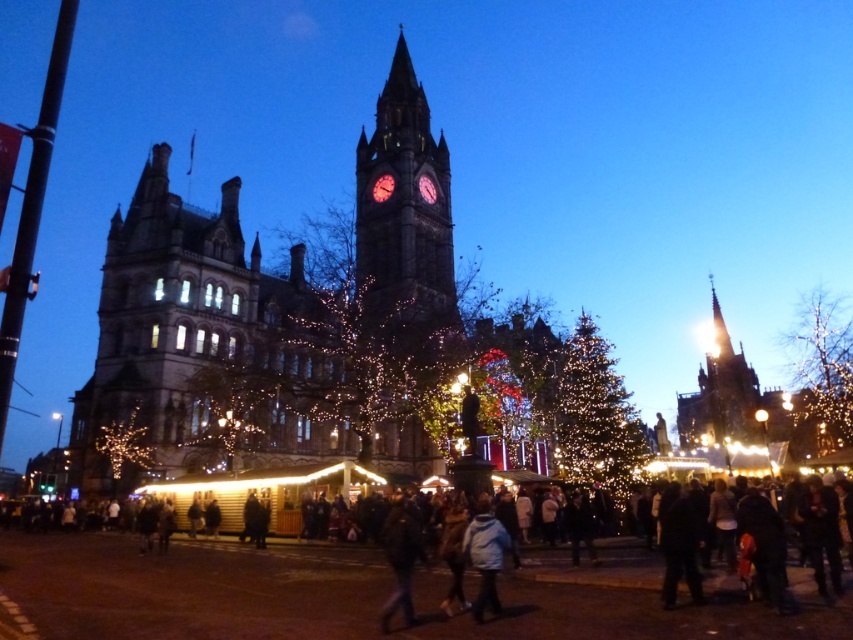
You are standing in the festive market area in front of the historic building. You want to take a photo of the polished stone clock tower at center. If your camera can focus on objects up to 250 feet away, will you be able to capture a clear image of the tower?

The distance between you and the polished stone clock tower at center is 244.13 feet, which is within the camera focus range of 250 feet. Therefore, you can capture a clear image of the tower.